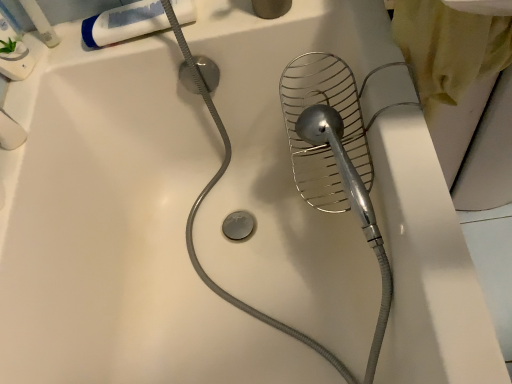
The width and height of the screenshot is (512, 384). What do you see at coordinates (40, 22) in the screenshot?
I see `white plastic tube at upper left` at bounding box center [40, 22].

Locate an element on the screen. The height and width of the screenshot is (384, 512). white plastic tube at upper left is located at coordinates (40, 22).

What is the approximate width of white plastic tube at upper left?

white plastic tube at upper left is 2.21 inches wide.

Locate an element on the screen. This screenshot has width=512, height=384. white matte tube at upper left is located at coordinates (124, 23).

What do you see at coordinates (124, 23) in the screenshot? The width and height of the screenshot is (512, 384). I see `white matte tube at upper left` at bounding box center [124, 23].

Where is `white plastic tube at upper left`? white plastic tube at upper left is located at coordinates (40, 22).

Which object is positioned more to the right, white matte tube at upper left or white plastic tube at upper left?

white matte tube at upper left.

Looking at this image, between white matte tube at upper left and white plastic tube at upper left, which one is positioned in front?

white plastic tube at upper left is closer to the camera.

Is point (177, 16) farther from camera compared to point (30, 17)?

No, it is not.

From the image's perspective, relative to white plastic tube at upper left, is white matte tube at upper left above or below?

From the image's perspective, white matte tube at upper left appears below white plastic tube at upper left.

From a real-world perspective, relative to white plastic tube at upper left, is white matte tube at upper left vertically above or below?

Clearly, from a real-world perspective, white matte tube at upper left is below white plastic tube at upper left.

Which object is wider, white matte tube at upper left or white plastic tube at upper left?

white matte tube at upper left.

Who is shorter, white matte tube at upper left or white plastic tube at upper left?

white matte tube at upper left.

Looking at the image, does white matte tube at upper left seem bigger or smaller compared to white plastic tube at upper left?

white matte tube at upper left is bigger than white plastic tube at upper left.

Is white plastic tube at upper left completely or partially inside white matte tube at upper left?

Definitely not — white plastic tube at upper left is not inside white matte tube at upper left.

Is white matte tube at upper left next to white plastic tube at upper left and touching it?

No, white matte tube at upper left is not making contact with white plastic tube at upper left.

Is white matte tube at upper left facing away from white plastic tube at upper left?

white matte tube at upper left is not turned away from white plastic tube at upper left.

I want to click on toothpaste on the right of white plastic tube at upper left, so click(x=124, y=23).

Considering the positions of objects white plastic tube at upper left and white matte tube at upper left in the image provided, who is more to the right, white plastic tube at upper left or white matte tube at upper left?

From the viewer's perspective, white matte tube at upper left appears more on the right side.

Who is more distant, white plastic tube at upper left or white matte tube at upper left?

white matte tube at upper left is behind.

Considering the positions of points (49, 42) and (141, 12), is point (49, 42) closer to camera compared to point (141, 12)?

No.

From the image's perspective, which one is positioned lower, white plastic tube at upper left or white matte tube at upper left?

white matte tube at upper left, from the image's perspective.

From a real-world perspective, relative to white matte tube at upper left, is white plastic tube at upper left vertically above or below?

From a real-world perspective, white plastic tube at upper left is physically above white matte tube at upper left.

Considering the sizes of objects white plastic tube at upper left and white matte tube at upper left in the image provided, who is wider, white plastic tube at upper left or white matte tube at upper left?

With larger width is white matte tube at upper left.

Who is shorter, white plastic tube at upper left or white matte tube at upper left?

white matte tube at upper left.

Based on their sizes in the image, would you say white plastic tube at upper left is bigger or smaller than white matte tube at upper left?

Considering their sizes, white plastic tube at upper left takes up less space than white matte tube at upper left.

Is white plastic tube at upper left spatially inside white matte tube at upper left, or outside of it?

white plastic tube at upper left exists outside the volume of white matte tube at upper left.

Based on the photo, are white plastic tube at upper left and white matte tube at upper left far apart?

white plastic tube at upper left is near white matte tube at upper left, not far away.

Is white plastic tube at upper left facing away from white matte tube at upper left?

→ No, white plastic tube at upper left is not facing the opposite direction of white matte tube at upper left.

Identify the location of toothpaste below the white plastic tube at upper left (from a real-world perspective). (124, 23).

This screenshot has width=512, height=384. In order to click on toiletry lying on the left of white matte tube at upper left in this screenshot , I will do `click(40, 22)`.

Where is `toothpaste located underneath the white plastic tube at upper left (from a real-world perspective)`? The image size is (512, 384). toothpaste located underneath the white plastic tube at upper left (from a real-world perspective) is located at coordinates (124, 23).